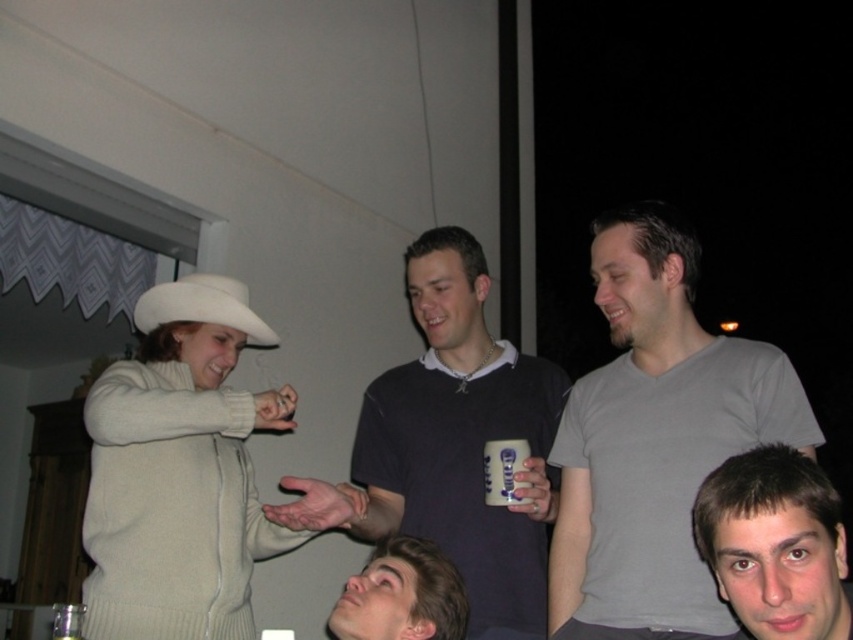
You are at a party and want to take a photo of the dark gray sweater at center and the smooth skin face at lower right. Which one should you focus on first if you want to capture both clearly in the same frame?

The dark gray sweater at center is taller than the smooth skin face at lower right, so you should focus on the dark gray sweater at center first to ensure both are in focus.

You are standing in the room and want to hand a gift to the person wearing the dark gray sweater at center. The gift is 1.5 meters away from you. Can you reach them without moving closer?

The dark gray sweater at center is 1.63 meters from the camera, so if the gift is 1.5 meters away from you, you need to move 0.13 meters closer to reach them.

You are a photographer trying to capture a candid shot of the smooth skin face at lower center and the white glossy cup at center. Since you want to ensure both subjects are in focus, you need to know their sizes relative to each other. Which object is wider?

The smooth skin face at lower center is wider than the white glossy cup at center because its width surpasses the cup.